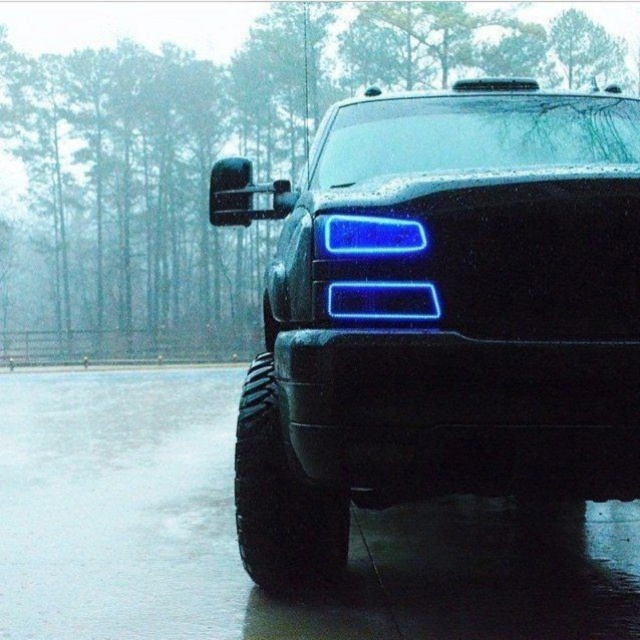
Which of these two, blue plastic headlights at center or blue glossy rectangle at center, stands taller?

blue plastic headlights at center is taller.

Between point (612, 461) and point (397, 312), which one is positioned in front?

Point (612, 461) is in front.

What are the coordinates of `blue plastic headlights at center` in the screenshot? It's located at (442, 314).